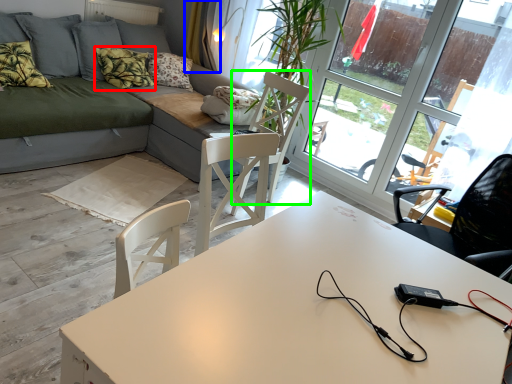
Question: Which object is the farthest from pillow (highlighted by a red box)? Choose among these: curtain (highlighted by a blue box) or swivel chair (highlighted by a green box).

Choices:
 (A) curtain
 (B) swivel chair

Answer: (B)